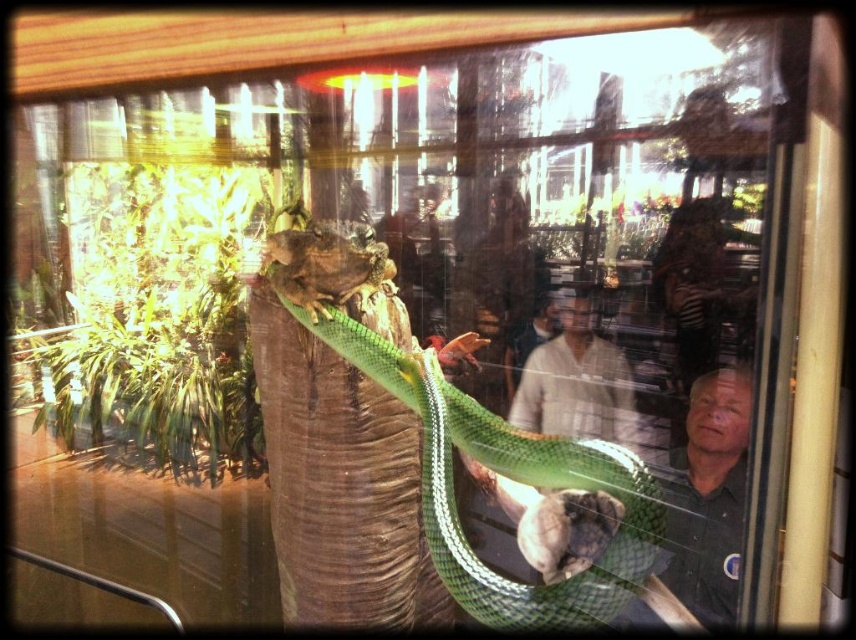
Can you confirm if green glossy snake at center is positioned to the left of green scaly lizard at center?

In fact, green glossy snake at center is to the right of green scaly lizard at center.

Between green glossy snake at center and green scaly lizard at center, which one has less height?

green scaly lizard at center is shorter.

In order to click on green glossy snake at center in this screenshot , I will do `click(476, 452)`.

Find the location of a particular element. This screenshot has height=640, width=856. green glossy snake at center is located at coordinates (476, 452).

Who is lower down, matte white shirt at center or dark green shirt at right?

dark green shirt at right

Can you confirm if matte white shirt at center is shorter than dark green shirt at right?

Correct, matte white shirt at center is not as tall as dark green shirt at right.

Is point (544, 429) positioned before point (740, 480)?

No, (544, 429) is behind (740, 480).

Find the location of a particular element. The width and height of the screenshot is (856, 640). matte white shirt at center is located at coordinates (575, 381).

Describe the element at coordinates (476, 452) in the screenshot. I see `green glossy snake at center` at that location.

Between point (432, 467) and point (696, 387), which one is positioned in front?

Point (432, 467) is in front.

What are the coordinates of `green glossy snake at center` in the screenshot? It's located at (476, 452).